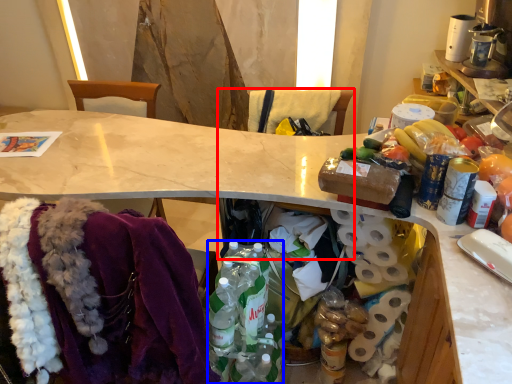
Question: Which object appears closest to the camera in this image, chair (highlighted by a red box) or bottle (highlighted by a blue box)?

Choices:
 (A) chair
 (B) bottle

Answer: (A)